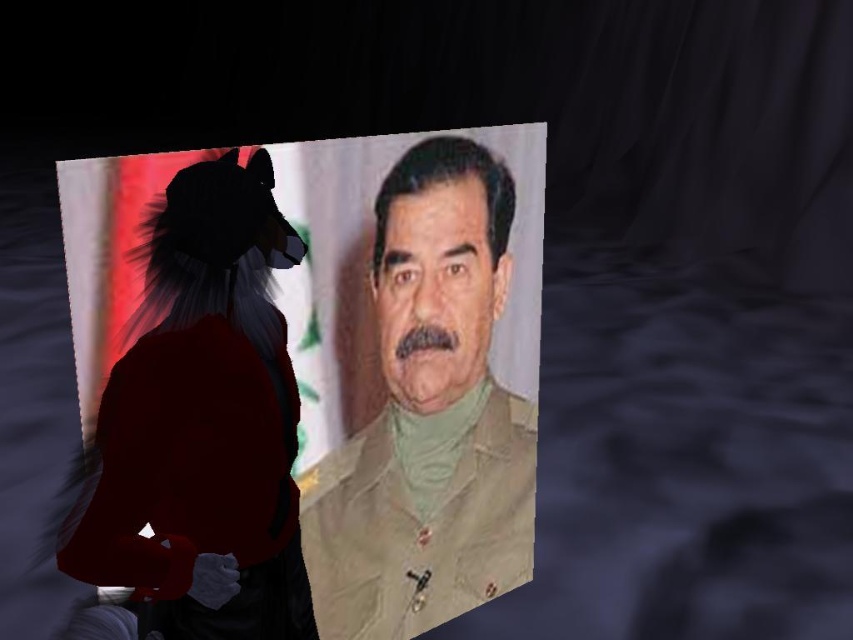
Between beige matte uniform at center and beige uniform at center, which one has more height?

Standing taller between the two is beige matte uniform at center.

Can you confirm if beige matte uniform at center is thinner than beige uniform at center?

No.

Who is more distant from viewer, (402, 429) or (450, 529)?

The point (450, 529) is behind.

The height and width of the screenshot is (640, 853). I want to click on beige matte uniform at center, so click(x=299, y=392).

Does point (509, 544) come closer to viewer compared to point (471, 253)?

No, (509, 544) is further to viewer.

Can you confirm if beige uniform at center is positioned to the right of beige matte face at center?

Indeed, beige uniform at center is positioned on the right side of beige matte face at center.

Is point (456, 321) less distant than point (473, 260)?

Yes, it is.

Identify the location of beige uniform at center. (428, 416).

Which of these two, beige matte uniform at center or beige matte face at center, stands taller?

Standing taller between the two is beige matte uniform at center.

Which is below, beige matte uniform at center or beige matte face at center?

beige matte uniform at center is below.

You are a GUI agent. You are given a task and a screenshot of the screen. Output one action in this format:
    pyautogui.click(x=<x>, y=<y>)
    Task: Click on the beige matte uniform at center
    The image size is (853, 640).
    Given the screenshot: What is the action you would take?
    pyautogui.click(x=299, y=392)